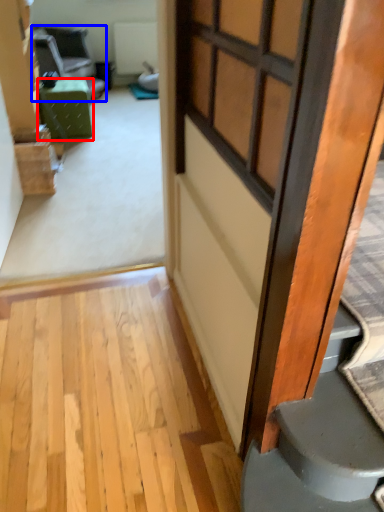
Question: Which object is closer to the camera taking this photo, furniture (highlighted by a red box) or chair (highlighted by a blue box)?

Choices:
 (A) furniture
 (B) chair

Answer: (A)